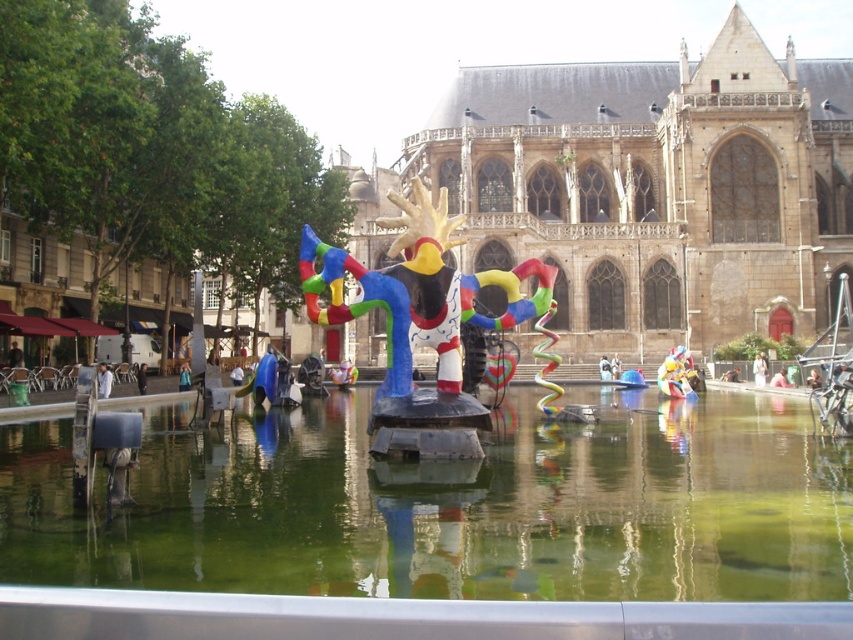
Question: Which object appears farthest from the camera in this image?

Choices:
 (A) green reflective water at center
 (B) multicolored plastic toy at center

Answer: (B)

Question: Which point is farther from the camera taking this photo?

Choices:
 (A) (665, 371)
 (B) (819, 132)
 (C) (683, 586)
 (D) (448, 404)

Answer: (B)

Question: Can you confirm if green reflective water at center is wider than multicolored plastic sculpture at center?

Choices:
 (A) no
 (B) yes

Answer: (B)

Question: Does brown stone cathedral at center appear under multicolored plastic toy at center?

Choices:
 (A) no
 (B) yes

Answer: (A)

Question: Is green reflective water at center wider than brown stone cathedral at center?

Choices:
 (A) no
 (B) yes

Answer: (A)

Question: Which of these objects is positioned farthest from the multicolored plastic sculpture at center?

Choices:
 (A) green reflective water at center
 (B) brown stone cathedral at center
 (C) multicolored plastic toy at center

Answer: (C)